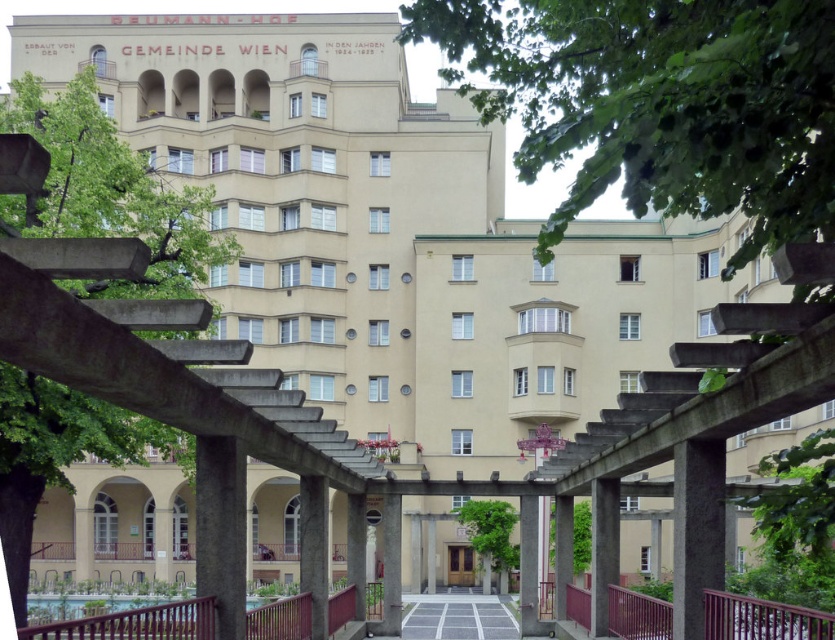
Question: Among these points, which one is nearest to the camera?

Choices:
 (A) (281, 634)
 (B) (444, 596)

Answer: (A)

Question: Which of the following is the farthest from the observer?

Choices:
 (A) (486, 612)
 (B) (173, 609)
 (C) (611, 634)

Answer: (A)

Question: Based on their relative distances, which object is nearer to the metallic burgundy railing at lower center?

Choices:
 (A) gray concrete path at center
 (B) red painted metal railing at lower center

Answer: (B)

Question: Is metallic burgundy railing at lower center positioned behind gray concrete path at center?

Choices:
 (A) yes
 (B) no

Answer: (B)

Question: Is metallic burgundy railing at lower center positioned behind gray concrete path at center?

Choices:
 (A) yes
 (B) no

Answer: (B)

Question: Does red painted metal railing at lower center appear on the right side of metallic burgundy railing at lower center?

Choices:
 (A) no
 (B) yes

Answer: (A)